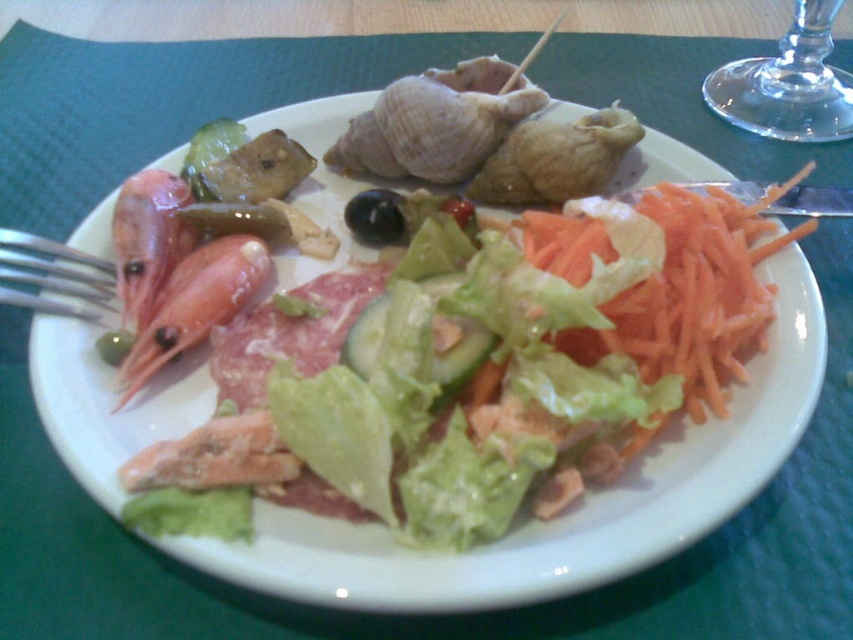
Question: Which point is farther to the camera?

Choices:
 (A) (579, 468)
 (B) (126, 365)

Answer: (B)

Question: Is transparent glass at upper right bigger than pinkish translucent prawns at center-left?

Choices:
 (A) no
 (B) yes

Answer: (B)

Question: Does green leafy salad at center appear under silver metallic fork at left?

Choices:
 (A) no
 (B) yes

Answer: (B)

Question: Which object is farther from the camera taking this photo?

Choices:
 (A) silver metallic fork at left
 (B) green crisp pickle at center
 (C) pinkish translucent prawns at center-left

Answer: (A)

Question: Among these points, which one is farthest from the camera?

Choices:
 (A) (7, 266)
 (B) (439, 464)

Answer: (A)

Question: Is slightly pinkish raw meat at center above pinkish translucent prawns at center-left?

Choices:
 (A) yes
 (B) no

Answer: (B)